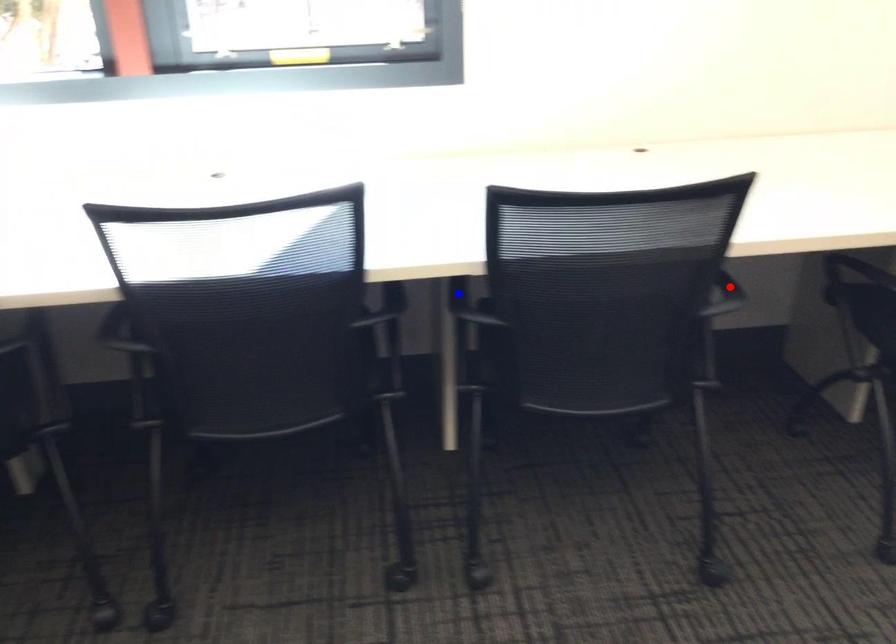
Question: Two points are marked on the image. Which point is closer to the camera?

Choices:
 (A) Blue point is closer.
 (B) Red point is closer.

Answer: (A)